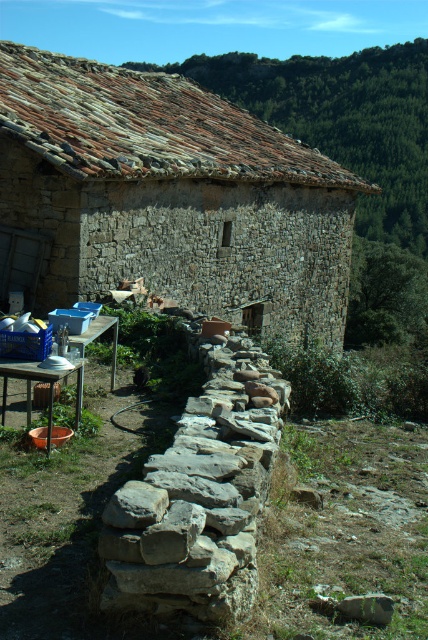
You are planning to set up a picnic and need to know the exact location of the metallic silver picnic table at lower left relative to the rustic stone building. Can you determine its coordinates based on the scene description?

The metallic silver picnic table at lower left is located at point coordinates of [41,380].